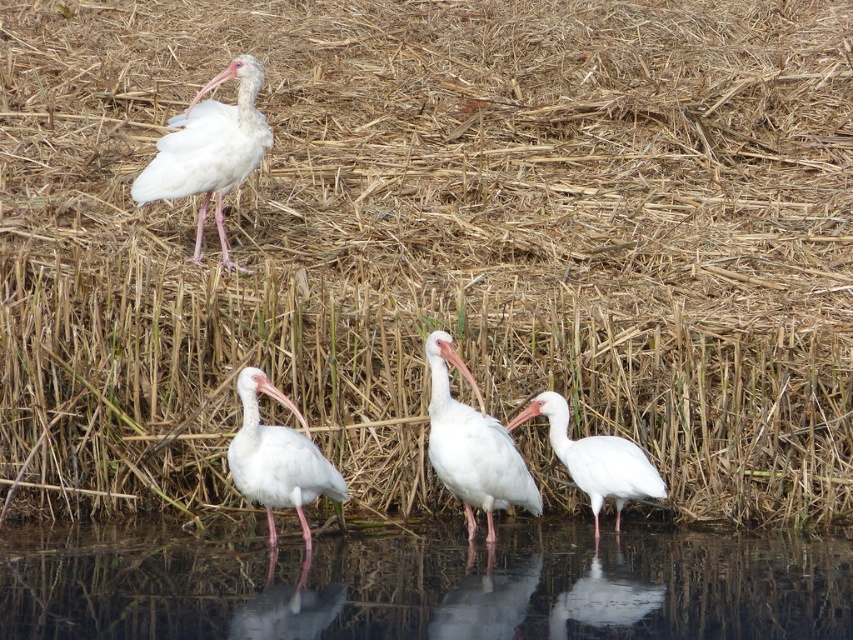
You are a birdwatcher observing the scene. You notice a specific point marked at coordinates (473, 445). Which object in the scene does this point correspond to?

The point at coordinates (473, 445) is on the white matte bird at center.

Looking at this image, you are a birdwatcher observing the white matte ibis at upper left and the white matte bird at lower center. Which of these two birds is taller?

The white matte ibis at upper left is much taller than the white matte bird at lower center.

You are a photographer trying to capture the white matte bird at center in your shot. Based on its 2D coordinates, where should you position your camera to ensure it is centered in the frame?

To center the white matte bird at center in your frame, position your camera so that the crosshairs align with the coordinates point (473, 445).